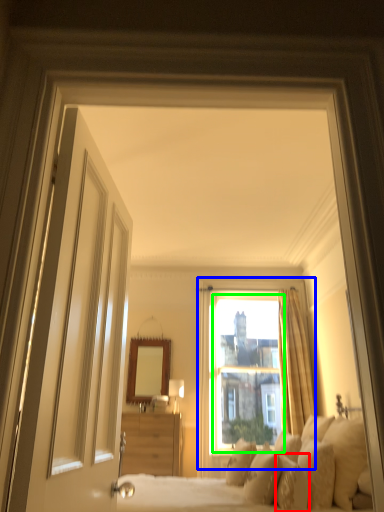
Question: Considering the real-world distances, which object is closest to pillow (highlighted by a red box)? window (highlighted by a blue box) or window screen (highlighted by a green box).

Choices:
 (A) window
 (B) window screen

Answer: (B)